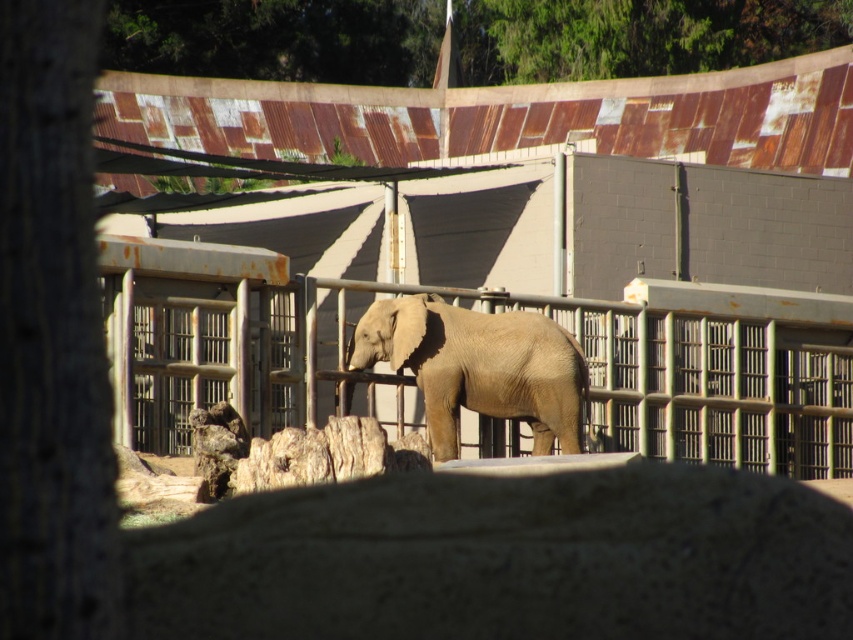
Question: Which object is farther from the camera taking this photo?

Choices:
 (A) green leafy tree at upper center
 (B) smooth beige elephant at center
 (C) brown rough bark tree at left

Answer: (A)

Question: Observing the image, what is the correct spatial positioning of brown rough bark tree at left in reference to smooth beige elephant at center?

Choices:
 (A) above
 (B) below

Answer: (B)

Question: Estimate the real-world distances between objects in this image. Which object is closer to the smooth beige elephant at center?

Choices:
 (A) green leafy tree at upper center
 (B) brown rough bark tree at left

Answer: (B)

Question: Among these points, which one is farthest from the camera?

Choices:
 (A) (39, 166)
 (B) (544, 380)

Answer: (B)

Question: Is green leafy tree at upper center to the left of smooth beige elephant at center from the viewer's perspective?

Choices:
 (A) yes
 (B) no

Answer: (B)

Question: Is brown rough bark tree at left to the left of green leafy tree at upper center from the viewer's perspective?

Choices:
 (A) no
 (B) yes

Answer: (B)